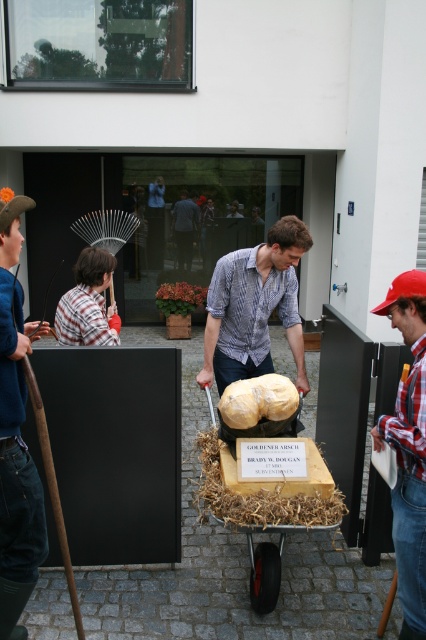
Question: Which point is closer to the camera taking this photo?

Choices:
 (A) (386, 307)
 (B) (97, 324)

Answer: (A)

Question: Can you confirm if matte yellow cheese at center is positioned to the left of red plaid shirt at lower right?

Choices:
 (A) no
 (B) yes

Answer: (B)

Question: Among these points, which one is nearest to the camera?

Choices:
 (A) (284, 392)
 (B) (399, 328)
 (C) (192, 221)
 (D) (282, 234)

Answer: (B)

Question: In this image, where is matte yellow cheese at center located relative to red plaid shirt at lower right?

Choices:
 (A) left
 (B) right

Answer: (A)

Question: Is matte yellow cheese at center smaller than plaid shirt at left?

Choices:
 (A) yes
 (B) no

Answer: (B)

Question: Which of the following is the farthest from the observer?

Choices:
 (A) red plaid shirt at lower right
 (B) yellow matte sculpture at center
 (C) matte yellow cheese at center

Answer: (C)